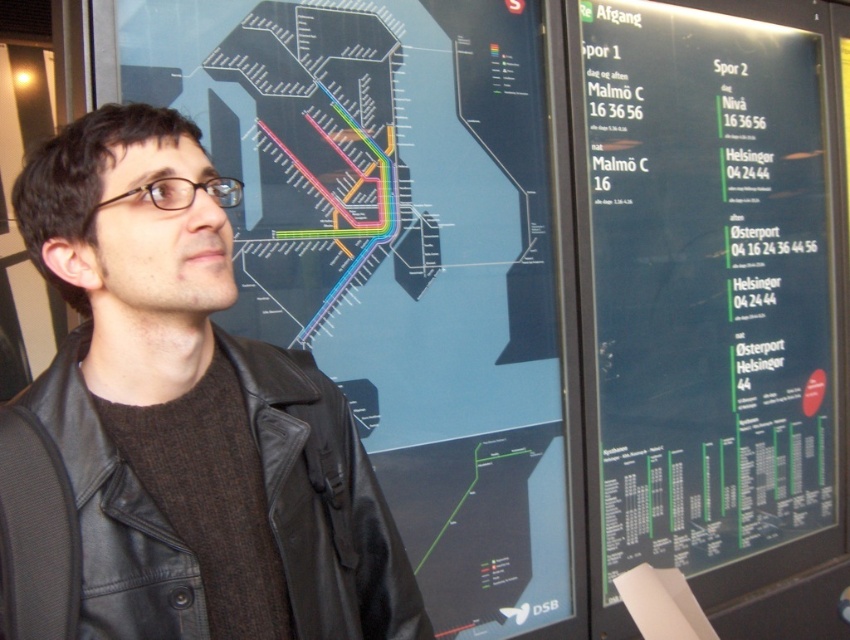
Question: Is matte black map at upper center closer to the viewer compared to dark blue/black matte sign at right?

Choices:
 (A) no
 (B) yes

Answer: (B)

Question: Is matte black map at upper center bigger than dark blue/black matte sign at right?

Choices:
 (A) no
 (B) yes

Answer: (A)

Question: Among these points, which one is farthest from the camera?

Choices:
 (A) (723, 552)
 (B) (507, 358)
 (C) (128, 532)

Answer: (A)

Question: Does matte black map at upper center come behind black leather jacket at center?

Choices:
 (A) no
 (B) yes

Answer: (B)

Question: Which object appears farthest from the camera in this image?

Choices:
 (A) dark blue/black matte sign at right
 (B) matte black map at upper center

Answer: (A)

Question: Which of the following is the farthest from the observer?

Choices:
 (A) (10, 460)
 (B) (165, 72)

Answer: (B)